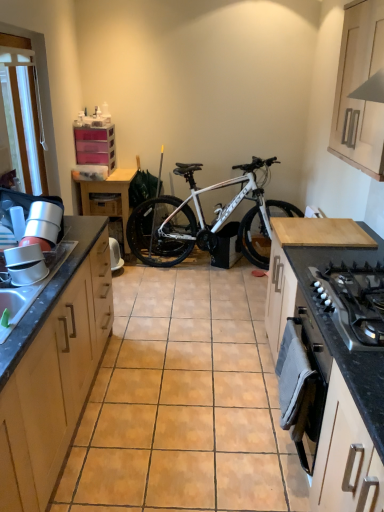
Locate an element on the screen. free space in front of white matte bicycle at center is located at coordinates (211, 295).